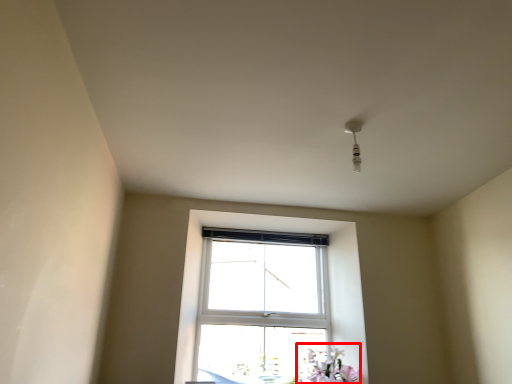
Question: From the image, what is the correct spatial relationship of flower (annotated by the red box) in relation to light fixture?

Choices:
 (A) right
 (B) left

Answer: (B)